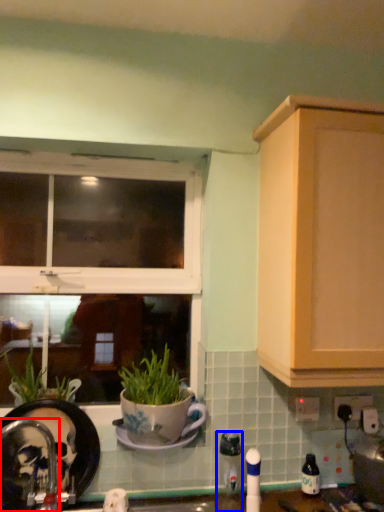
Question: Which of the following is the farthest to the observer, faucet (highlighted by a red box) or appliance (highlighted by a blue box)?

Choices:
 (A) faucet
 (B) appliance

Answer: (B)